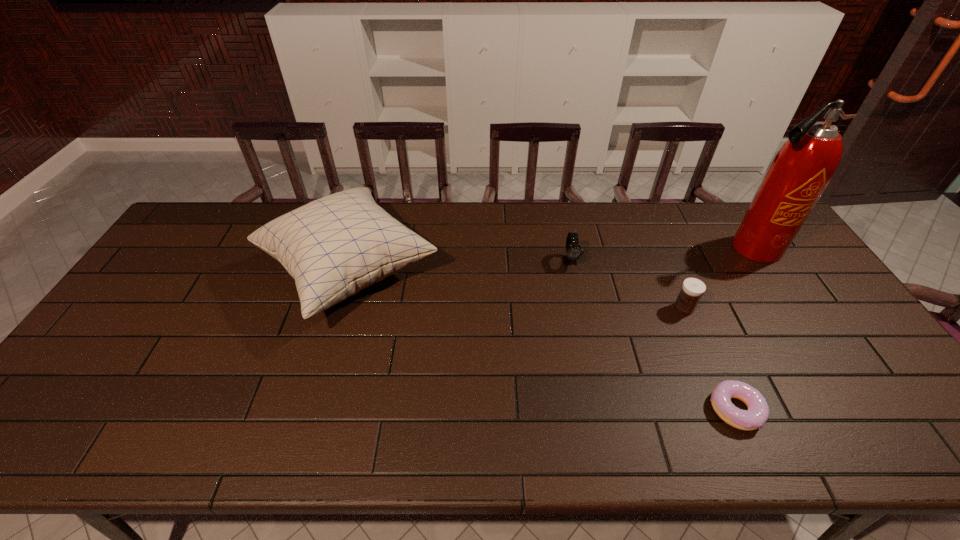
The width and height of the screenshot is (960, 540). In order to click on free space that is in between the rightmost object and the shortest object in this screenshot , I will do `click(744, 329)`.

The height and width of the screenshot is (540, 960). Find the location of `vacant space that's between the second object from left to right and the medicine`. vacant space that's between the second object from left to right and the medicine is located at coordinates (627, 285).

The image size is (960, 540). In order to click on free space between the medicine and the watch in this screenshot , I will do `click(627, 285)`.

Where is `object that stands as the fourth closest to the rightmost object`? This screenshot has height=540, width=960. object that stands as the fourth closest to the rightmost object is located at coordinates (335, 246).

Where is `object that is the third closest to the leftmost object`? This screenshot has width=960, height=540. object that is the third closest to the leftmost object is located at coordinates (692, 289).

Find the location of a particular element. The height and width of the screenshot is (540, 960). free spot that satisfies the following two spatial constraints: 1. on the back side of the medicine; 2. on the left side of the rightmost object is located at coordinates (658, 248).

Where is `free location that satisfies the following two spatial constraints: 1. on the face of the medicine; 2. on the right side of the fourth object from right to left`? This screenshot has width=960, height=540. free location that satisfies the following two spatial constraints: 1. on the face of the medicine; 2. on the right side of the fourth object from right to left is located at coordinates (580, 308).